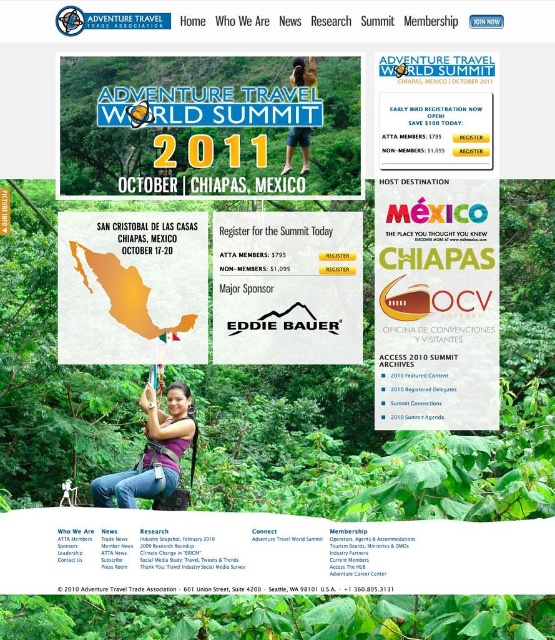
Question: Can you confirm if metallic green sign at center is smaller than matte black shorts at upper center?

Choices:
 (A) no
 (B) yes

Answer: (A)

Question: From the image, what is the correct spatial relationship of matte black logo at center in relation to matte black shorts at upper center?

Choices:
 (A) above
 (B) below

Answer: (B)

Question: Which of these objects is positioned closest to the matte black logo at center?

Choices:
 (A) matte black shorts at upper center
 (B) metallic green sign at center

Answer: (B)

Question: Which point is farther to the camera?

Choices:
 (A) matte black shorts at upper center
 (B) matte black logo at center
 (C) matte purple shirt at center

Answer: (B)

Question: Estimate the real-world distances between objects in this image. Which object is closer to the matte black logo at center?

Choices:
 (A) matte black shorts at upper center
 (B) matte map of mexico at center
 (C) metallic green sign at center
 (D) matte purple shirt at center

Answer: (B)

Question: Is matte map of mexico at center further to the viewer compared to matte purple shirt at center?

Choices:
 (A) yes
 (B) no

Answer: (A)